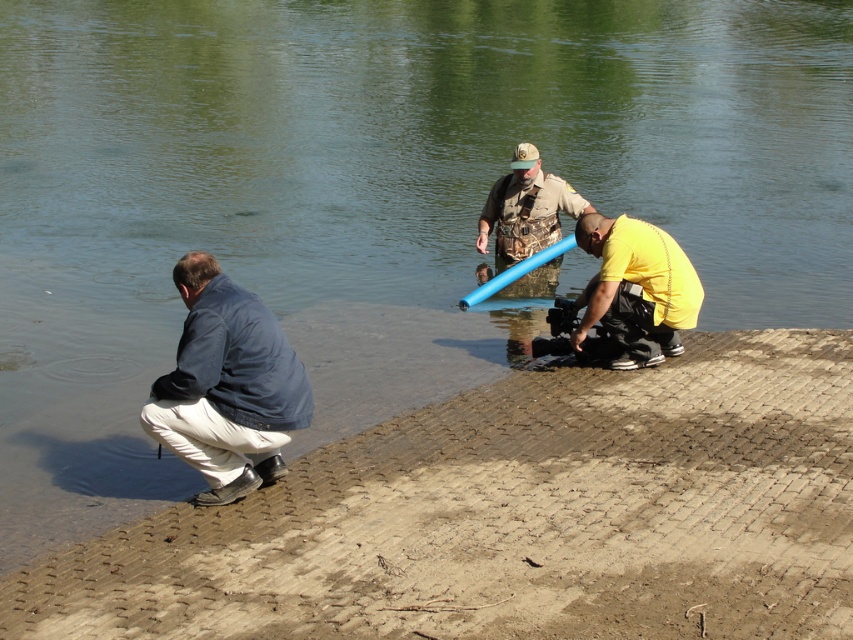
You are standing on the paved area in the foreground of the image. There is a point marked at coordinates (515, 516). Based on the scene description, where is this point located?

The point marked at coordinates (515, 516) is located on the brown textured shore at lower left.

You are standing at the center of the paved area in the foreground of the image. You want to walk to the brown textured shore at lower left. Which direction should you move in?

You should move to the lower left direction to reach the brown textured shore at lower left.